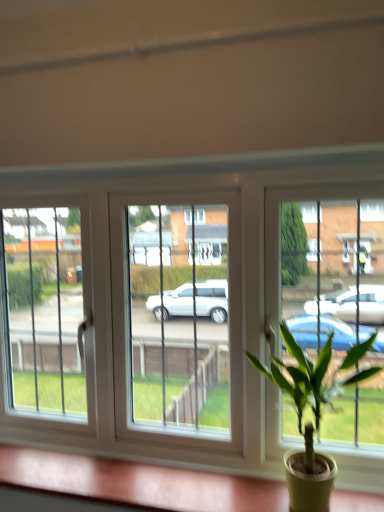
Question: Should I look upward or downward to see green leafy plant in pot at center?

Choices:
 (A) up
 (B) down

Answer: (B)

Question: From a real-world perspective, is green leafy plant in pot at center located beneath green matte plant pot at lower right?

Choices:
 (A) no
 (B) yes

Answer: (A)

Question: Is green leafy plant in pot at center aimed at green matte plant pot at lower right?

Choices:
 (A) yes
 (B) no

Answer: (B)

Question: Are green leafy plant in pot at center and green matte plant pot at lower right located far from each other?

Choices:
 (A) yes
 (B) no

Answer: (B)

Question: Would you say green leafy plant in pot at center is outside green matte plant pot at lower right?

Choices:
 (A) yes
 (B) no

Answer: (A)

Question: Considering the relative sizes of green leafy plant in pot at center and green matte plant pot at lower right in the image provided, is green leafy plant in pot at center smaller than green matte plant pot at lower right?

Choices:
 (A) yes
 (B) no

Answer: (B)

Question: Can you confirm if green leafy plant in pot at center is taller than green matte plant pot at lower right?

Choices:
 (A) yes
 (B) no

Answer: (A)

Question: Is green matte plant pot at lower right bigger than green leafy plant in pot at center?

Choices:
 (A) no
 (B) yes

Answer: (A)

Question: Is there a large distance between green matte plant pot at lower right and green leafy plant in pot at center?

Choices:
 (A) yes
 (B) no

Answer: (B)

Question: From the image's perspective, is green matte plant pot at lower right on top of green leafy plant in pot at center?

Choices:
 (A) no
 (B) yes

Answer: (A)

Question: Can we say green matte plant pot at lower right lies outside green leafy plant in pot at center?

Choices:
 (A) yes
 (B) no

Answer: (A)

Question: From the image's perspective, is green matte plant pot at lower right below green leafy plant in pot at center?

Choices:
 (A) yes
 (B) no

Answer: (A)

Question: From a real-world perspective, is green matte plant pot at lower right positioned under green leafy plant in pot at center based on gravity?

Choices:
 (A) yes
 (B) no

Answer: (A)

Question: From a real-world perspective, is green matte plant pot at lower right positioned above or below green leafy plant in pot at center?

Choices:
 (A) above
 (B) below

Answer: (B)